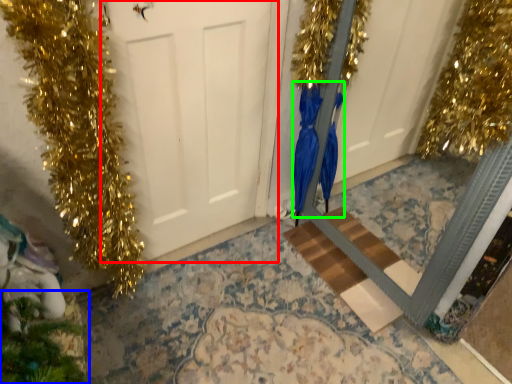
Question: Which is nearer to the door (highlighted by a red box)? christmas decoration (highlighted by a blue box) or dress (highlighted by a green box).

Choices:
 (A) christmas decoration
 (B) dress

Answer: (B)